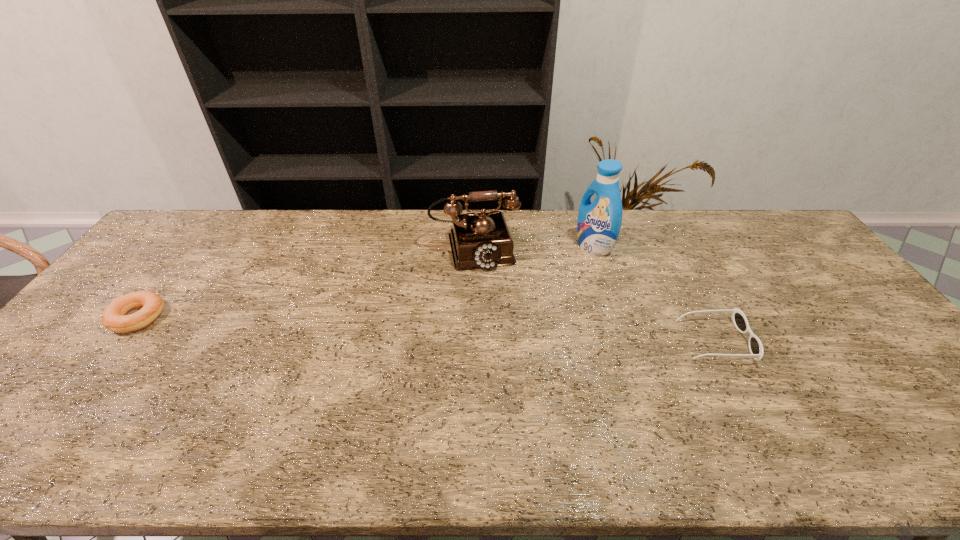
The image size is (960, 540). I want to click on vacant space on the desktop that is between the leftmost object and the rightmost object and is positioned on the dial of the third shortest object, so click(493, 332).

Where is `free space on the desktop that is between the leftmost object and the sunglasses and is positioned on the front-facing side of the detergent`? The height and width of the screenshot is (540, 960). free space on the desktop that is between the leftmost object and the sunglasses and is positioned on the front-facing side of the detergent is located at coordinates (435, 329).